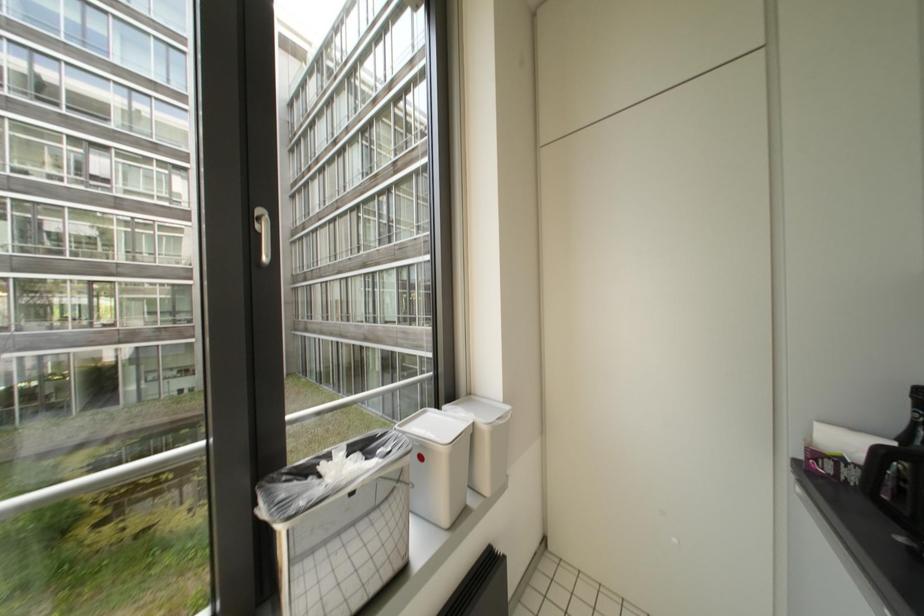
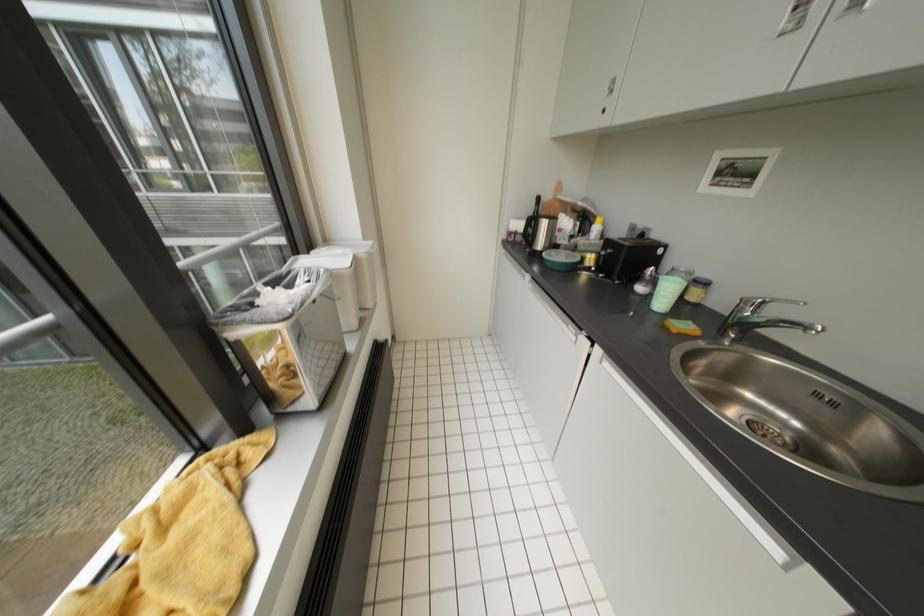
The images are taken continuously from a first-person perspective. In which direction is your viewpoint rotating?

The camera rotated toward right-down.